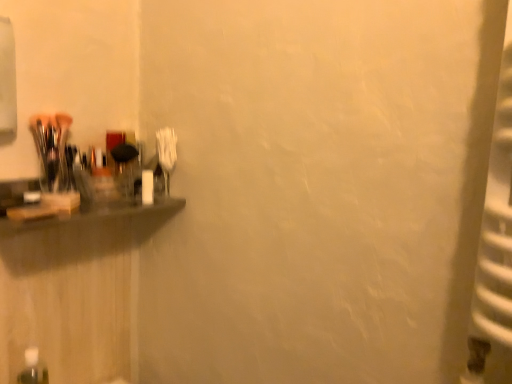
You are a GUI agent. You are given a task and a screenshot of the screen. Output one action in this format:
    pyautogui.click(x=<x>, y=<y>)
    Task: Click on the matte black shelf at left
    The image size is (512, 384).
    Given the screenshot: What is the action you would take?
    pyautogui.click(x=98, y=211)

Describe the element at coordinates (98, 211) in the screenshot. I see `matte black shelf at left` at that location.

The height and width of the screenshot is (384, 512). I want to click on transparent plastic bottle at lower left, so click(33, 369).

What do you see at coordinates (33, 369) in the screenshot? I see `transparent plastic bottle at lower left` at bounding box center [33, 369].

I want to click on matte black shelf at left, so click(98, 211).

Does transparent plastic bottle at lower left appear on the left side of matte black shelf at left?

Correct, you'll find transparent plastic bottle at lower left to the left of matte black shelf at left.

Which object is further away from the camera taking this photo, transparent plastic bottle at lower left or matte black shelf at left?

transparent plastic bottle at lower left is behind.

Considering the points (30, 377) and (20, 187), which point is in front, point (30, 377) or point (20, 187)?

The point (20, 187) is closer.

From the image's perspective, is transparent plastic bottle at lower left located above or below matte black shelf at left?

transparent plastic bottle at lower left is situated lower than matte black shelf at left in the image.

From a real-world perspective, relative to matte black shelf at left, is transparent plastic bottle at lower left vertically above or below?

Clearly, from a real-world perspective, transparent plastic bottle at lower left is below matte black shelf at left.

Is transparent plastic bottle at lower left wider than matte black shelf at left?

Incorrect, the width of transparent plastic bottle at lower left does not surpass that of matte black shelf at left.

Which of these two, transparent plastic bottle at lower left or matte black shelf at left, stands shorter?

matte black shelf at left is shorter.

Between transparent plastic bottle at lower left and matte black shelf at left, which one has smaller size?

transparent plastic bottle at lower left is smaller.

Is transparent plastic bottle at lower left completely or partially outside of matte black shelf at left?

transparent plastic bottle at lower left lies outside matte black shelf at left's area.

Is there a large distance between transparent plastic bottle at lower left and matte black shelf at left?

No, there isn't a large distance between transparent plastic bottle at lower left and matte black shelf at left.

Is transparent plastic bottle at lower left looking in the opposite direction of matte black shelf at left?

No, transparent plastic bottle at lower left is not facing the opposite direction of matte black shelf at left.

Locate an element on the screen. shelf in front of the transparent plastic bottle at lower left is located at coordinates (98, 211).

Visually, is matte black shelf at left positioned to the left or to the right of transparent plastic bottle at lower left?

From the image, it's evident that matte black shelf at left is to the right of transparent plastic bottle at lower left.

Relative to transparent plastic bottle at lower left, is matte black shelf at left in front or behind?

matte black shelf at left is in front of transparent plastic bottle at lower left.

Which is in front, point (112, 215) or point (25, 362)?

The point (25, 362) is closer.

From the image's perspective, is matte black shelf at left above or below transparent plastic bottle at lower left?

Based on their image positions, matte black shelf at left is located above transparent plastic bottle at lower left.

From a real-world perspective, is matte black shelf at left on top of transparent plastic bottle at lower left?

Indeed, from a real-world perspective, matte black shelf at left stands above transparent plastic bottle at lower left.

Between matte black shelf at left and transparent plastic bottle at lower left, which one has smaller width?

Thinner between the two is transparent plastic bottle at lower left.

Who is shorter, matte black shelf at left or transparent plastic bottle at lower left?

With less height is matte black shelf at left.

Can you confirm if matte black shelf at left is smaller than transparent plastic bottle at lower left?

Actually, matte black shelf at left might be larger than transparent plastic bottle at lower left.

Choose the correct answer: Is matte black shelf at left inside transparent plastic bottle at lower left or outside it?

matte black shelf at left lies outside transparent plastic bottle at lower left.

Is matte black shelf at left far from transparent plastic bottle at lower left?

They are positioned close to each other.

Is matte black shelf at left looking in the opposite direction of transparent plastic bottle at lower left?

No.

From the picture: How many degrees apart are the facing directions of matte black shelf at left and transparent plastic bottle at lower left?

0.00159 degrees separate the facing orientations of matte black shelf at left and transparent plastic bottle at lower left.

At what (x,y) coordinates should I click in order to perform the action: click on shelf above the transparent plastic bottle at lower left (from a real-world perspective). Please return your answer as a coordinate pair (x, y). The height and width of the screenshot is (384, 512). Looking at the image, I should click on (98, 211).

Find the location of a particular element. shelf that is in front of the transparent plastic bottle at lower left is located at coordinates (98, 211).

Where is `bottle below the matte black shelf at left (from the image's perspective)`? Image resolution: width=512 pixels, height=384 pixels. bottle below the matte black shelf at left (from the image's perspective) is located at coordinates (33, 369).